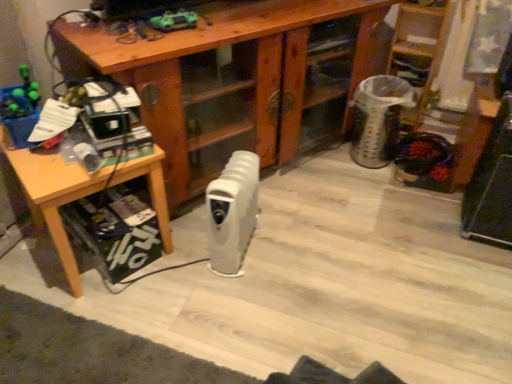
Question: From a real-world perspective, is wooden desk at center physically below wooden ladder at upper right?

Choices:
 (A) no
 (B) yes

Answer: (B)

Question: From a real-world perspective, is wooden desk at center physically above wooden ladder at upper right?

Choices:
 (A) no
 (B) yes

Answer: (A)

Question: Are wooden desk at center and wooden ladder at upper right far apart?

Choices:
 (A) no
 (B) yes

Answer: (A)

Question: Is wooden desk at center behind wooden ladder at upper right?

Choices:
 (A) yes
 (B) no

Answer: (B)

Question: Is wooden desk at center at the left side of wooden ladder at upper right?

Choices:
 (A) no
 (B) yes

Answer: (B)

Question: Does wooden desk at center have a lesser width compared to wooden ladder at upper right?

Choices:
 (A) yes
 (B) no

Answer: (B)

Question: Can we say white plastic radiator at center lies outside wooden ladder at upper right?

Choices:
 (A) yes
 (B) no

Answer: (A)

Question: Can you confirm if white plastic radiator at center is positioned to the left of wooden ladder at upper right?

Choices:
 (A) no
 (B) yes

Answer: (B)

Question: Is white plastic radiator at center behind wooden ladder at upper right?

Choices:
 (A) yes
 (B) no

Answer: (B)

Question: Does white plastic radiator at center come in front of wooden ladder at upper right?

Choices:
 (A) yes
 (B) no

Answer: (A)

Question: Considering the relative sizes of white plastic radiator at center and wooden ladder at upper right in the image provided, is white plastic radiator at center taller than wooden ladder at upper right?

Choices:
 (A) no
 (B) yes

Answer: (A)

Question: Can you confirm if white plastic radiator at center is smaller than wooden ladder at upper right?

Choices:
 (A) no
 (B) yes

Answer: (B)

Question: Can we say wooden desk at center lies outside wooden table at left?

Choices:
 (A) no
 (B) yes

Answer: (B)